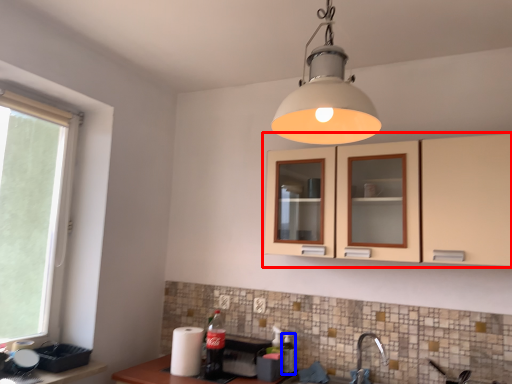
Question: Among these objects, which one is farthest to the camera, cabinetry (highlighted by a red box) or bottle (highlighted by a blue box)?

Choices:
 (A) cabinetry
 (B) bottle

Answer: (B)